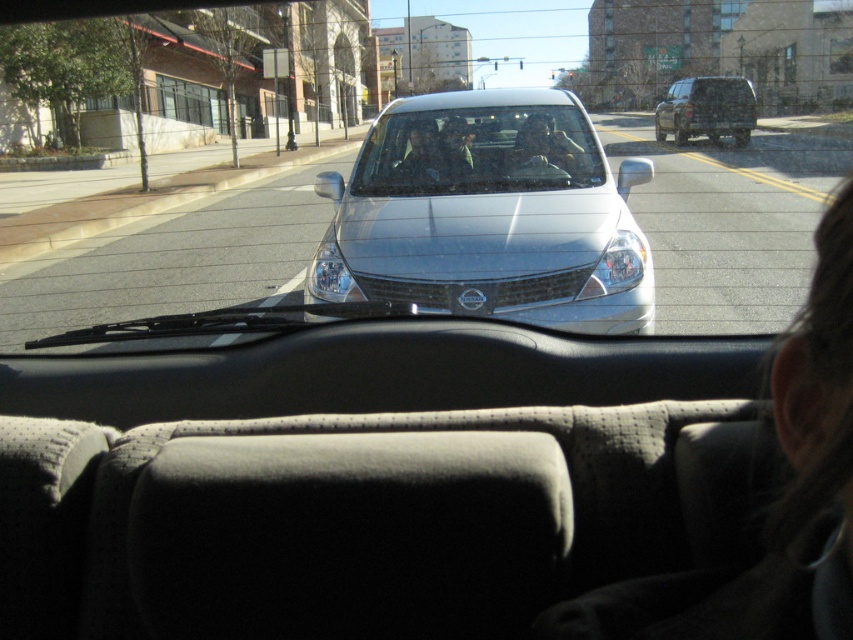
Which is below, silver metallic car at center or clear glass windshield at center?

clear glass windshield at center is below.

What do you see at coordinates (488, 214) in the screenshot? I see `silver metallic car at center` at bounding box center [488, 214].

Image resolution: width=853 pixels, height=640 pixels. What do you see at coordinates (488, 214) in the screenshot? I see `silver metallic car at center` at bounding box center [488, 214].

Where is `silver metallic car at center`? silver metallic car at center is located at coordinates (488, 214).

Is clear glass windshield at center to the left of matte black minivan at upper right from the viewer's perspective?

Correct, you'll find clear glass windshield at center to the left of matte black minivan at upper right.

Is clear glass windshield at center bigger than matte black minivan at upper right?

Actually, clear glass windshield at center might be smaller than matte black minivan at upper right.

Describe the element at coordinates (477, 150) in the screenshot. I see `clear glass windshield at center` at that location.

Find the location of `clear glass windshield at center`. clear glass windshield at center is located at coordinates (477, 150).

Does silver metallic car at center appear under matte black minivan at upper right?

Yes, silver metallic car at center is below matte black minivan at upper right.

Looking at this image, is silver metallic car at center bigger than matte black minivan at upper right?

No.

Is point (566, 216) positioned before point (740, 97)?

Yes, it is.

In order to click on silver metallic car at center in this screenshot , I will do `click(488, 214)`.